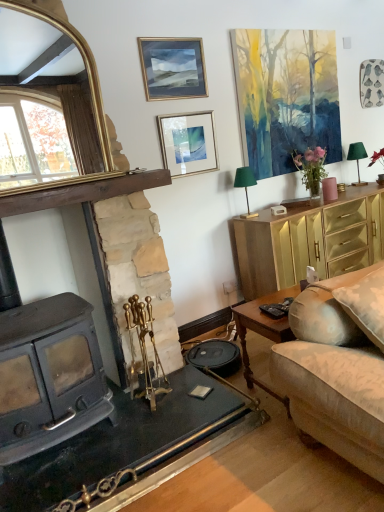
Where is `free space in front of pink matte vase at upper right`? free space in front of pink matte vase at upper right is located at coordinates (327, 203).